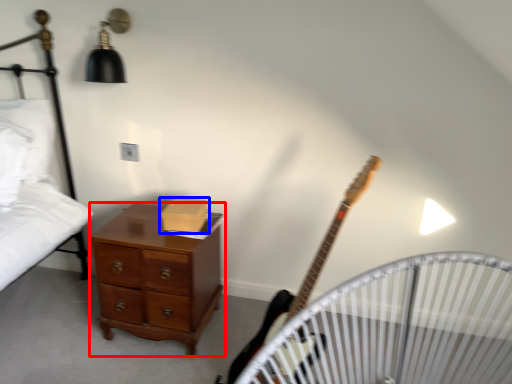
Question: Which object is further to the camera taking this photo, chest of drawers (highlighted by a red box) or box (highlighted by a blue box)?

Choices:
 (A) chest of drawers
 (B) box

Answer: (B)